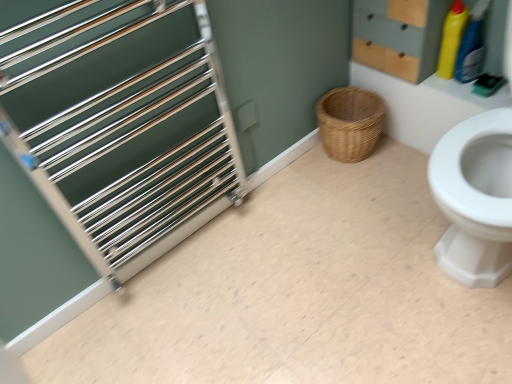
Where is `vacant area that is in front of yellow plastic bottle at upper right, arranged as the second cleaning product when viewed from the left`? vacant area that is in front of yellow plastic bottle at upper right, arranged as the second cleaning product when viewed from the left is located at coordinates tap(478, 94).